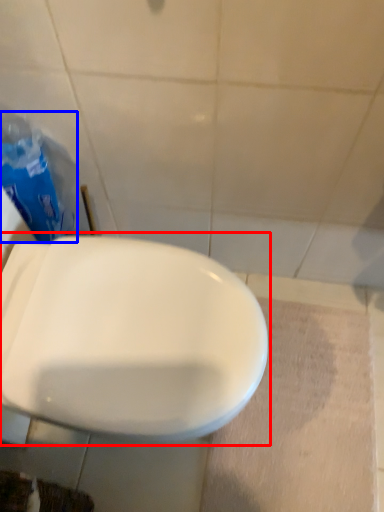
Question: Which object appears farthest to the camera in this image, toilet (highlighted by a red box) or garbage (highlighted by a blue box)?

Choices:
 (A) toilet
 (B) garbage

Answer: (B)